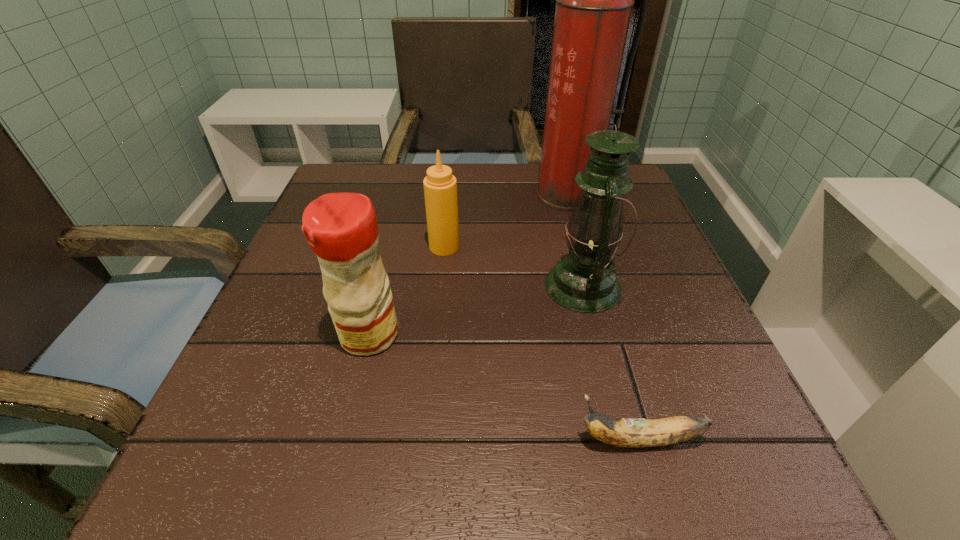
Identify the location of empty location between the nearest object and the oil lamp. Image resolution: width=960 pixels, height=540 pixels. (611, 363).

Identify which object is located as the third nearest to the shortest object. Please provide its 2D coordinates. Your answer should be formatted as a tuple, i.e. [(x, y)], where the tuple contains the x and y coordinates of a point satisfying the conditions above.

[(440, 187)]

Locate an element on the screen. The width and height of the screenshot is (960, 540). the fourth closest object to the farthest object is located at coordinates (625, 432).

What are the coordinates of `free spot that satisfies the following two spatial constraints: 1. on the back side of the second farthest object; 2. on the left side of the left condiment` in the screenshot? It's located at (391, 247).

Identify the location of free spot that satisfies the following two spatial constraints: 1. on the front side of the fourth nearest object; 2. on the left side of the oil lamp. This screenshot has width=960, height=540. (441, 286).